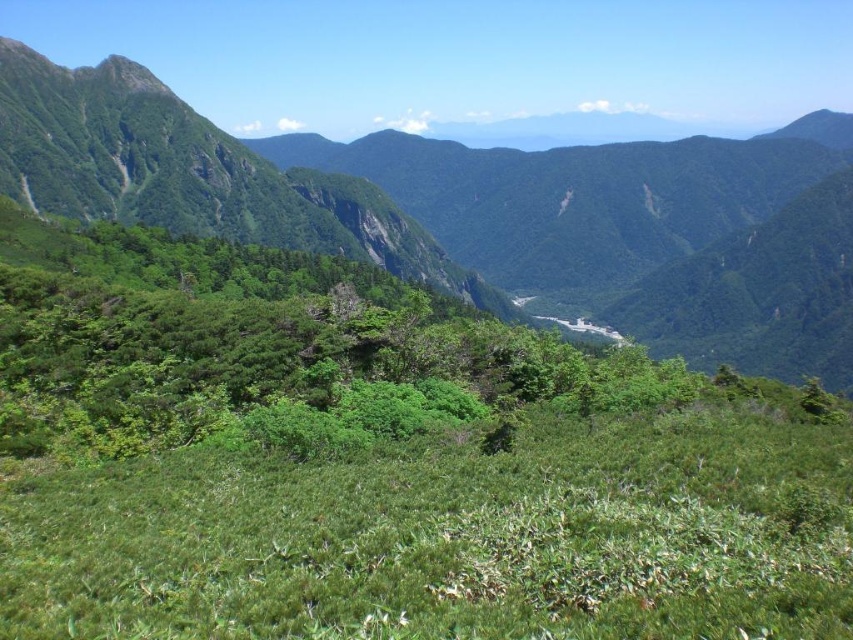
Question: Is the position of green leafy grass at center more distant than that of green leafy vegetation at center?

Choices:
 (A) yes
 (B) no

Answer: (B)

Question: Which point is closer to the camera?

Choices:
 (A) (287, 476)
 (B) (123, 134)

Answer: (A)

Question: Does green leafy grass at center have a lesser width compared to green leafy vegetation at center?

Choices:
 (A) yes
 (B) no

Answer: (A)

Question: Which point appears closest to the camera in this image?

Choices:
 (A) (543, 609)
 (B) (651, 164)

Answer: (A)

Question: From the image, what is the correct spatial relationship of green leafy grass at center in relation to green leafy vegetation at center?

Choices:
 (A) above
 (B) below

Answer: (B)

Question: Among these objects, which one is farthest from the camera?

Choices:
 (A) green leafy vegetation at center
 (B) green leafy grass at center

Answer: (A)